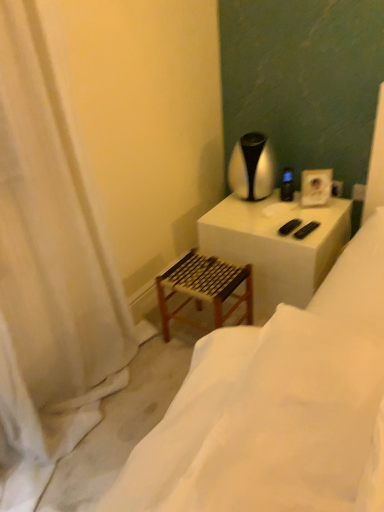
This screenshot has height=512, width=384. I want to click on vacant region to the left of black plastic remote control at upper right, so click(x=257, y=206).